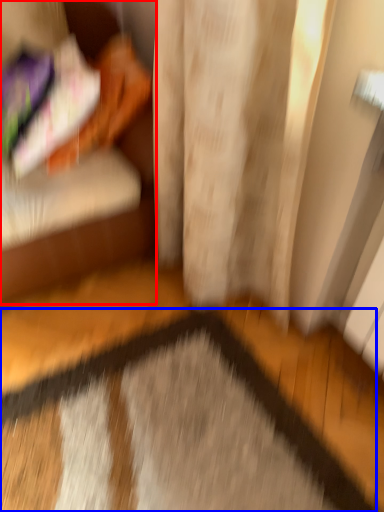
Question: Which point is closer to the camera, furniture (highlighted by a red box) or doormat (highlighted by a blue box)?

Choices:
 (A) furniture
 (B) doormat

Answer: (B)